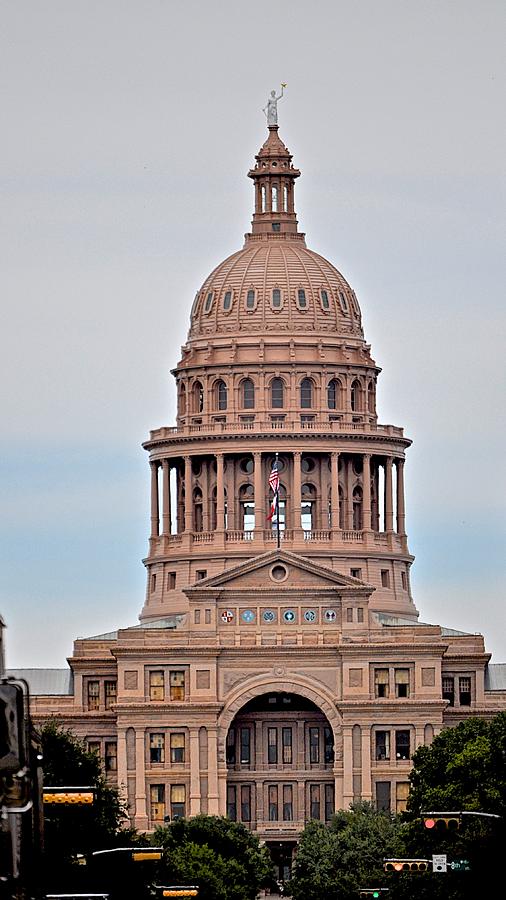
The image size is (506, 900). I want to click on statue, so click(x=274, y=112).